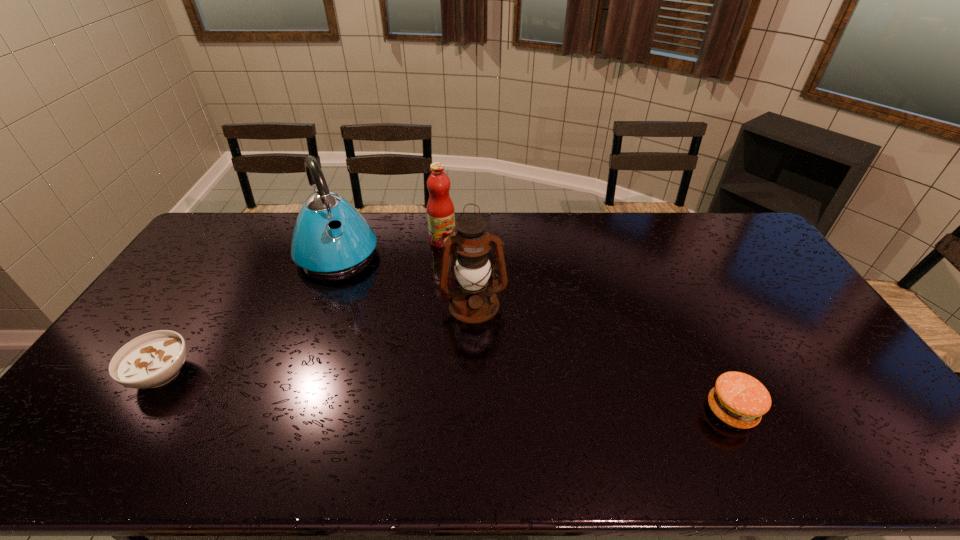
This screenshot has height=540, width=960. I want to click on soup bowl, so click(x=151, y=360).

You are a GUI agent. You are given a task and a screenshot of the screen. Output one action in this format:
    pyautogui.click(x=<x>, y=<y>)
    Task: Click on the leftmost object
    The width and height of the screenshot is (960, 540).
    Given the screenshot: What is the action you would take?
    pyautogui.click(x=151, y=360)

Find the location of a particular element. patty is located at coordinates (738, 399).

What are the coordinates of `the rightmost object` in the screenshot? It's located at (738, 399).

Where is `the third tallest object`? the third tallest object is located at coordinates [440, 209].

Locate an element on the screen. The width and height of the screenshot is (960, 540). the second object from left to right is located at coordinates (348, 244).

The image size is (960, 540). Find the location of `the third nearest object`. the third nearest object is located at coordinates (473, 241).

Identify the location of vacant area situated on the right of the soup bowl. (260, 374).

Image resolution: width=960 pixels, height=540 pixels. Identify the location of vacant region located on the back of the patty. (702, 347).

At what (x,y) coordinates should I click in order to perform the action: click on free space located on the front label of the third shortest object. Please return your answer as a coordinate pair (x, y). Image resolution: width=960 pixels, height=540 pixels. Looking at the image, I should click on (453, 261).